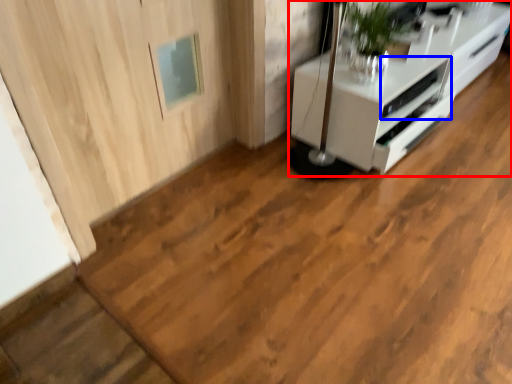
Question: Among these objects, which one is farthest to the camera, furniture (highlighted by a red box) or appliance (highlighted by a blue box)?

Choices:
 (A) furniture
 (B) appliance

Answer: (B)